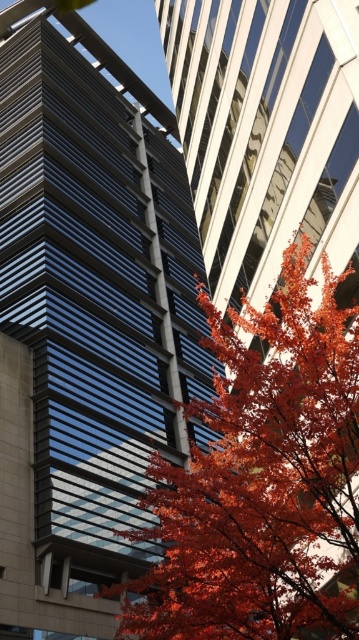
Question: Is smooth glass tower at center bigger than shiny red leaves at center?

Choices:
 (A) no
 (B) yes

Answer: (B)

Question: Does smooth glass tower at center appear on the left side of shiny red leaves at center?

Choices:
 (A) no
 (B) yes

Answer: (B)

Question: Can you confirm if smooth glass tower at center is thinner than shiny red leaves at center?

Choices:
 (A) no
 (B) yes

Answer: (A)

Question: Which point is closer to the camera?

Choices:
 (A) (81, 492)
 (B) (352, 532)

Answer: (B)